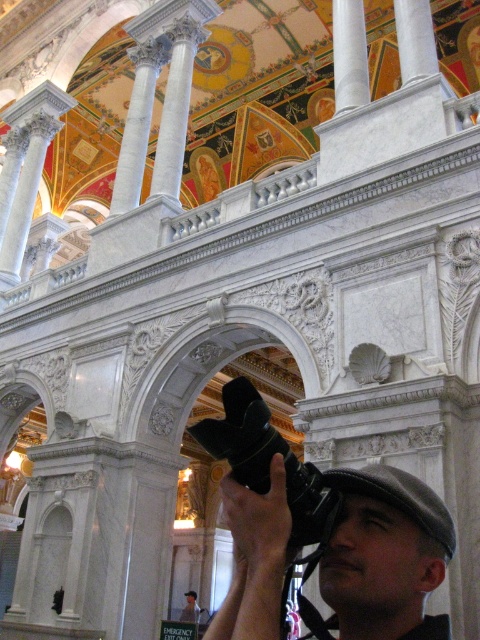
Can you confirm if black matte camera at center is positioned below black matte video camera at center?

Actually, black matte camera at center is above black matte video camera at center.

Consider the image. Who is taller, black matte camera at center or black matte video camera at center?

black matte video camera at center

Identify the location of black matte camera at center. (384, 554).

Does black matte camera at center have a larger size compared to white marble pillar at upper center?

No.

Can you confirm if black matte camera at center is wider than white marble pillar at upper center?

Indeed, black matte camera at center has a greater width compared to white marble pillar at upper center.

Which is behind, point (415, 561) or point (358, 36)?

The point (358, 36) is behind.

What are the coordinates of `black matte camera at center` in the screenshot? It's located at (384, 554).

Is black matte video camera at center bigger than white marble pillar at upper center?

Yes, black matte video camera at center is bigger than white marble pillar at upper center.

The image size is (480, 640). What do you see at coordinates (268, 461) in the screenshot?
I see `black matte video camera at center` at bounding box center [268, 461].

At what (x,y) coordinates should I click in order to perform the action: click on black matte video camera at center. Please return your answer as a coordinate pair (x, y). This screenshot has width=480, height=640. Looking at the image, I should click on (268, 461).